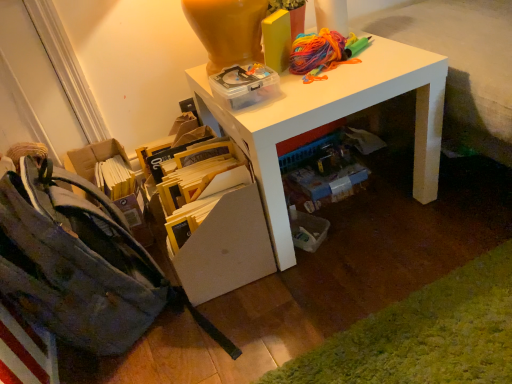
Question: Considering the positions of white glossy desk at upper center and floral canvas shoulder bag at lower left in the image, is white glossy desk at upper center bigger or smaller than floral canvas shoulder bag at lower left?

Choices:
 (A) small
 (B) big

Answer: (B)

Question: From the image's perspective, is white glossy desk at upper center located above or below floral canvas shoulder bag at lower left?

Choices:
 (A) above
 (B) below

Answer: (A)

Question: Estimate the real-world distances between objects in this image. Which object is closer to the yellow cardboard at lower left?

Choices:
 (A) floral canvas shoulder bag at lower left
 (B) white glossy desk at upper center
 (C) yellow cardboard book at lower center

Answer: (C)

Question: Based on their relative distances, which object is nearer to the yellow cardboard book at lower center?

Choices:
 (A) floral canvas shoulder bag at lower left
 (B) white glossy desk at upper center
 (C) yellow cardboard at lower left

Answer: (C)